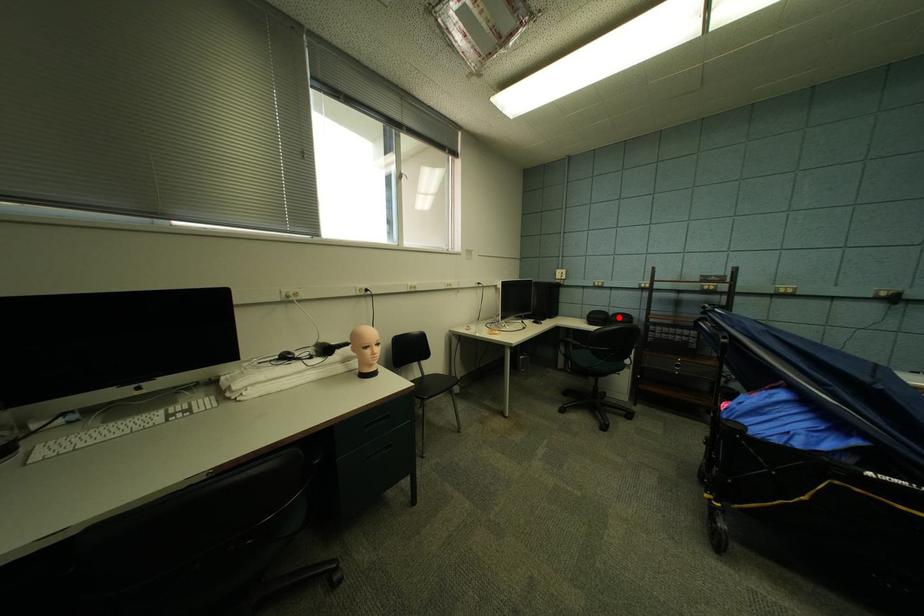
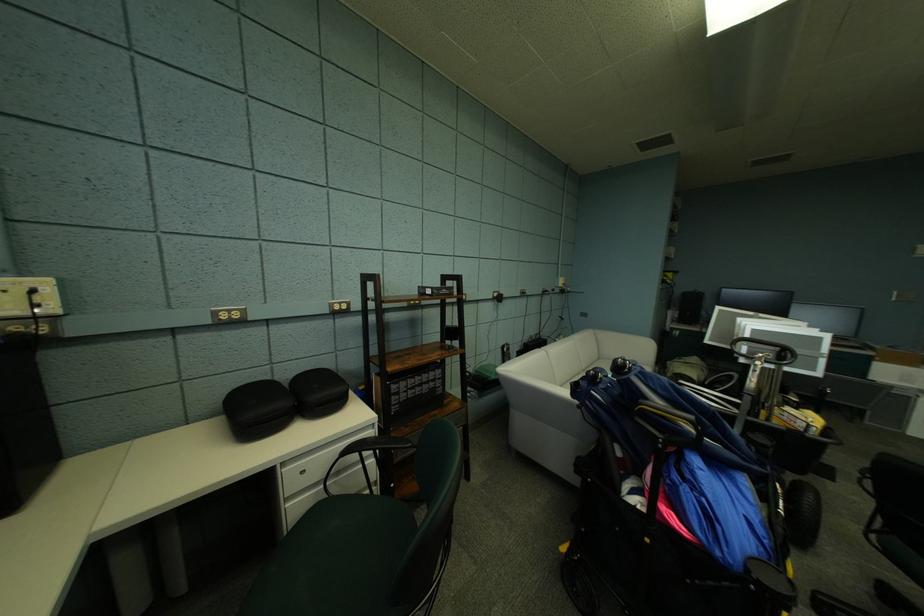
In the second image, find the point that corresponds to the highlighted location in the first image.

(297, 389)